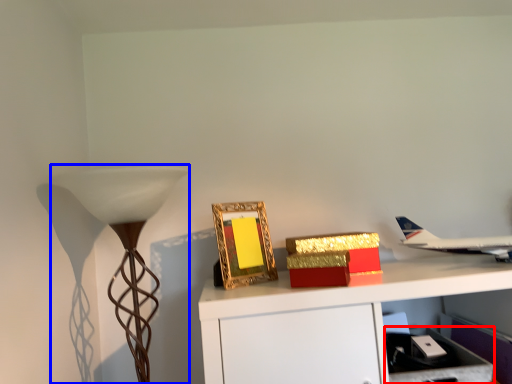
Question: Among these objects, which one is nearest to the camera, drawer (highlighted by a red box) or lamp (highlighted by a blue box)?

Choices:
 (A) drawer
 (B) lamp

Answer: (B)